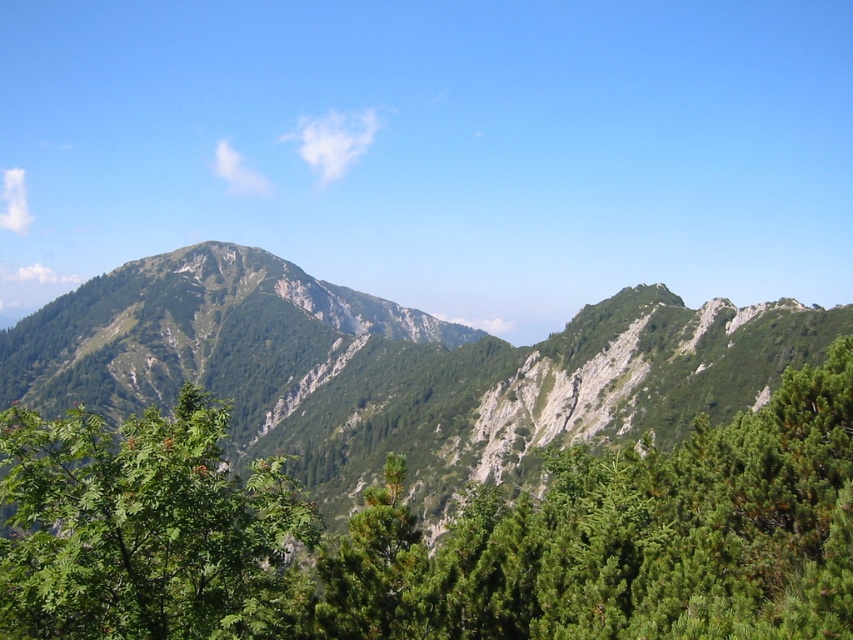
Is green rocky mountain range at center positioned at the back of green leafy tree at lower left?

Yes, green rocky mountain range at center is further from the viewer.

Does green rocky mountain range at center lie in front of green leafy tree at lower left?

No, it is behind green leafy tree at lower left.

Who is more forward, [561,369] or [33,636]?

Positioned in front is point [33,636].

The image size is (853, 640). What are the coordinates of `green rocky mountain range at center` in the screenshot? It's located at (393, 369).